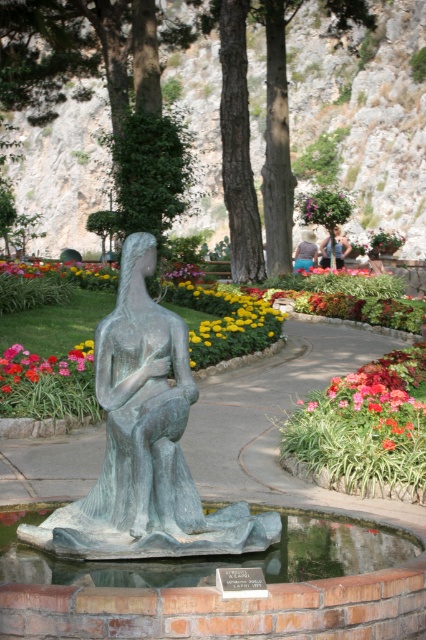
Based on the photo, which is more to the left, vivid pink petals at center or blue denim jeans at center?

vivid pink petals at center

Does vivid pink petals at center appear under blue denim jeans at center?

Yes.

Between point (37, 364) and point (342, 259), which one is positioned in front?

Positioned in front is point (37, 364).

Find the location of a particular element. The width and height of the screenshot is (426, 640). vivid pink petals at center is located at coordinates (43, 365).

Between green patina statue at center and yellowfloralflower at center, which one has more height?

yellowfloralflower at center is taller.

Between point (172, 502) and point (111, 275), which one is positioned behind?

Positioned behind is point (111, 275).

Identify the location of green patina statue at center. (146, 444).

Which is more to the right, red matte flower at lower right or yellowfloralflower at center?

red matte flower at lower right

Who is lower down, red matte flower at lower right or yellowfloralflower at center?

red matte flower at lower right is lower down.

Where is `red matte flower at lower right`? The height and width of the screenshot is (640, 426). red matte flower at lower right is located at coordinates (379, 397).

Locate an element on the screen. The height and width of the screenshot is (640, 426). red matte flower at lower right is located at coordinates (379, 397).